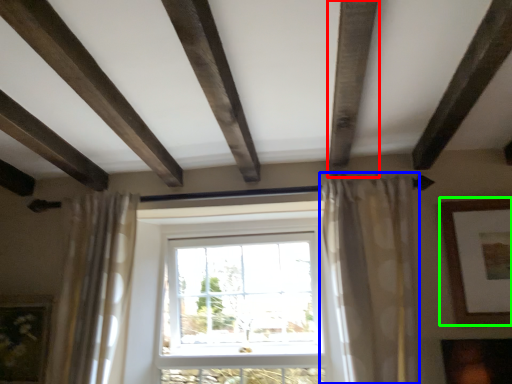
Question: Considering the real-world distances, which object is closest to plank (highlighted by a red box)? curtain (highlighted by a blue box) or picture frame (highlighted by a green box).

Choices:
 (A) curtain
 (B) picture frame

Answer: (A)